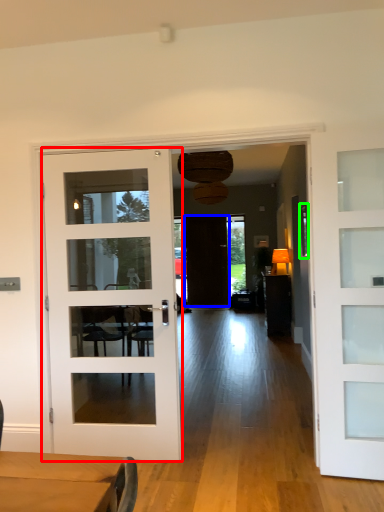
Question: Which object is positioned farthest from door (highlighted by a red box)? Select from door (highlighted by a blue box) and window (highlighted by a green box).

Choices:
 (A) door
 (B) window

Answer: (A)